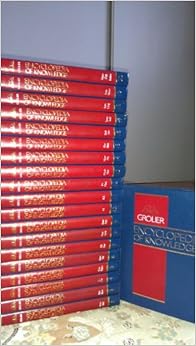
The height and width of the screenshot is (346, 196). I want to click on wall panel, so click(x=111, y=36).